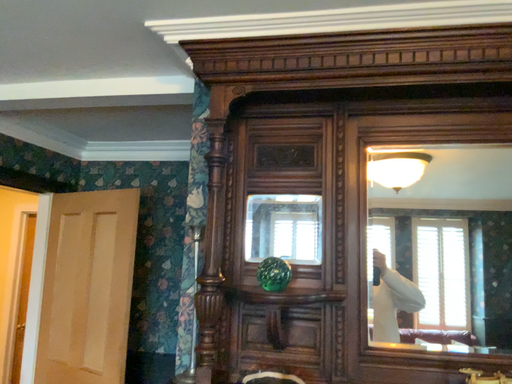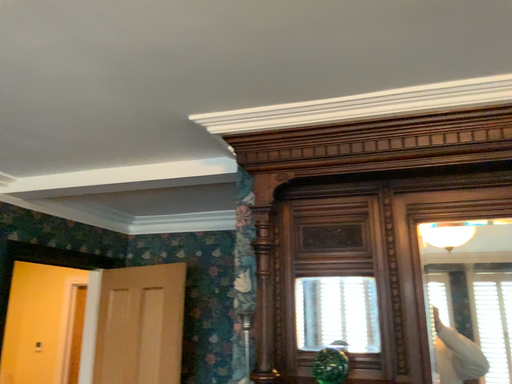
Question: Which way did the camera rotate in the video?

Choices:
 (A) rotated downward
 (B) rotated upward

Answer: (B)